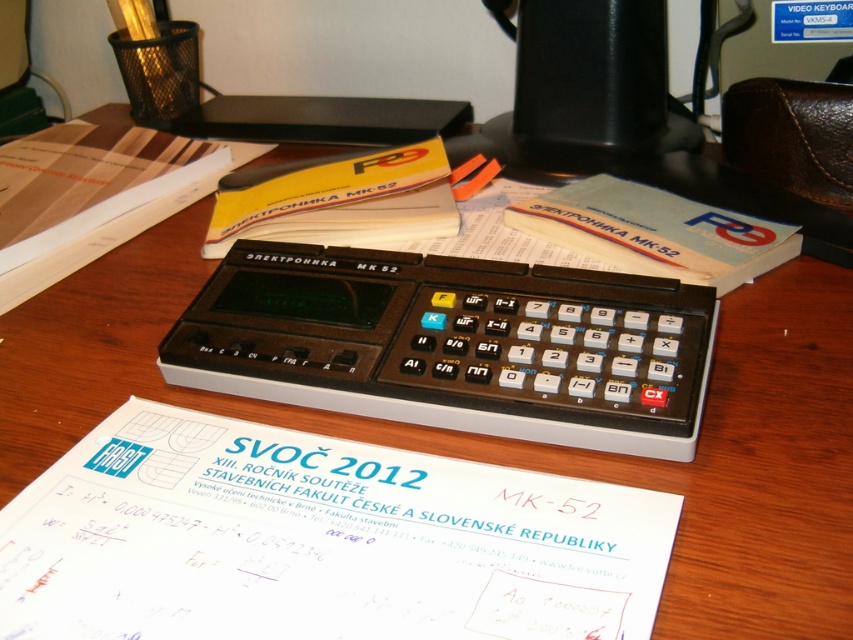
Which is more to the right, white paper at center or black plastic calculator at center?

black plastic calculator at center

Which is above, white paper at center or black plastic calculator at center?

black plastic calculator at center is above.

The width and height of the screenshot is (853, 640). What do you see at coordinates (317, 540) in the screenshot?
I see `white paper at center` at bounding box center [317, 540].

This screenshot has height=640, width=853. Find the location of `white paper at center`. white paper at center is located at coordinates (317, 540).